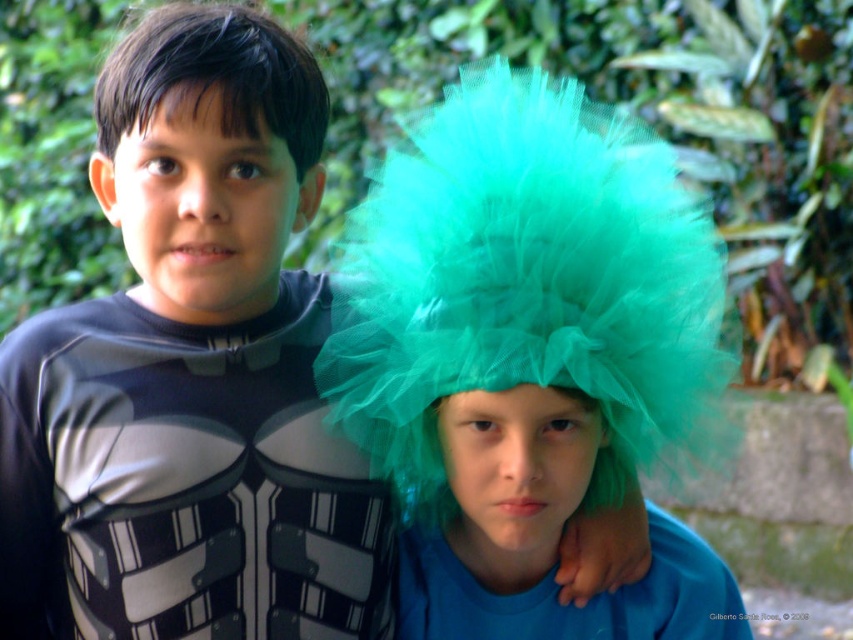
You are a photographer trying to capture both the turquoise tulle wig at center and the teal tulle wig at center in a single shot. Which wig should you adjust to ensure both are visible in the frame?

The turquoise tulle wig at center is positioned on the right side of teal tulle wig at center, so you should adjust the turquoise tulle wig at center to the left to ensure both are visible in the frame.

You are a photographer setting up a shoot in a garden. You have two wigs, a teal tulle wig at center and a green tulle wig at upper center. The teal one is bigger. You need to place a small prop between them so it doesn

The teal tulle wig at center is bigger than the green tulle wig at upper center, so place the prop between them closer to the smaller green tulle wig at upper center to balance the composition.

You are a photographer setting up for a group photo. You need to position two children wearing wigs so that there is at least 16 inches of space between their wigs. The children are currently positioned with the turquoise tulle wig at center and the green tulle wig at upper center. Can you achieve the required spacing without moving the children?

The distance between the turquoise tulle wig at center and the green tulle wig at upper center is currently 15.94 inches, which is just under the required 16 inches. To meet the spacing requirement, you would need to move the children slightly farther apart.